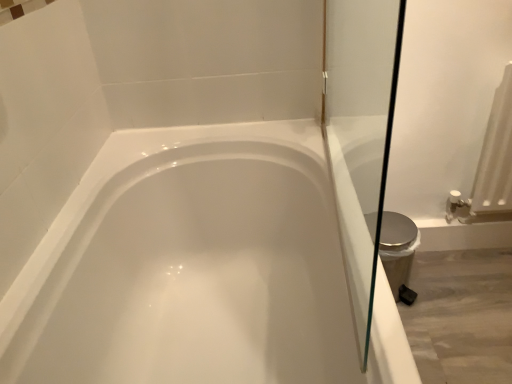
Question: Considering the positions of point (96, 360) and point (396, 264), is point (96, 360) closer or farther from the camera than point (396, 264)?

Choices:
 (A) farther
 (B) closer

Answer: (B)

Question: Visually, is white glossy bathtub at center positioned to the left or to the right of silver metallic bidet at right?

Choices:
 (A) left
 (B) right

Answer: (A)

Question: From a real-world perspective, is white glossy bathtub at center physically located above or below silver metallic bidet at right?

Choices:
 (A) above
 (B) below

Answer: (A)

Question: Is silver metallic bidet at right inside or outside of white glossy bathtub at center?

Choices:
 (A) outside
 (B) inside

Answer: (A)

Question: From the image's perspective, is silver metallic bidet at right above or below white glossy bathtub at center?

Choices:
 (A) above
 (B) below

Answer: (A)

Question: Would you say silver metallic bidet at right is to the left or to the right of white glossy bathtub at center in the picture?

Choices:
 (A) left
 (B) right

Answer: (B)

Question: From a real-world perspective, relative to white glossy bathtub at center, is silver metallic bidet at right vertically above or below?

Choices:
 (A) below
 (B) above

Answer: (A)